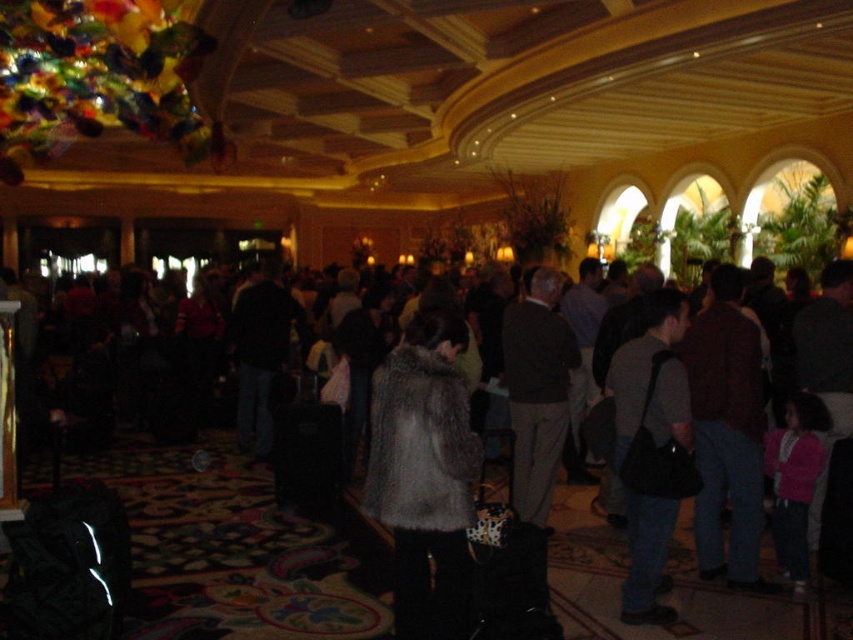
Question: Can you confirm if fuzzy gray coat at center is positioned to the left of gray fuzzy coat at center?

Choices:
 (A) yes
 (B) no

Answer: (A)

Question: Which point is closer to the camera?

Choices:
 (A) (538, 291)
 (B) (454, 348)

Answer: (B)

Question: Does gray fuzzy coat at center appear under dark gray suit at center?

Choices:
 (A) no
 (B) yes

Answer: (B)

Question: Which is nearer to the fuzzy gray coat at center?

Choices:
 (A) dark gray suit at center
 (B) gray fuzzy coat at center

Answer: (B)

Question: Can you confirm if gray fuzzy coat at center is positioned above dark gray suit at center?

Choices:
 (A) no
 (B) yes

Answer: (A)

Question: Which is nearer to the dark gray suit at center?

Choices:
 (A) fuzzy gray coat at center
 (B) gray fuzzy coat at center

Answer: (B)